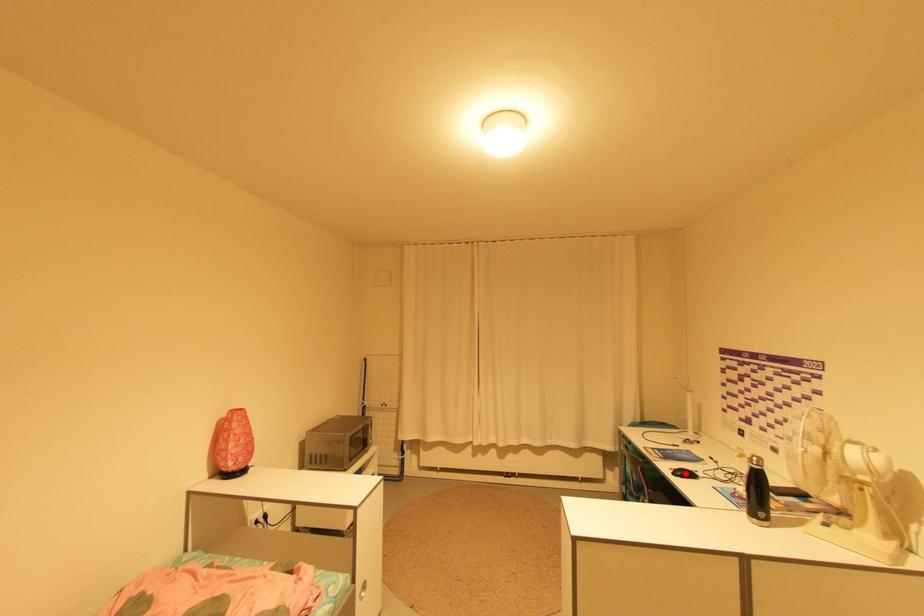
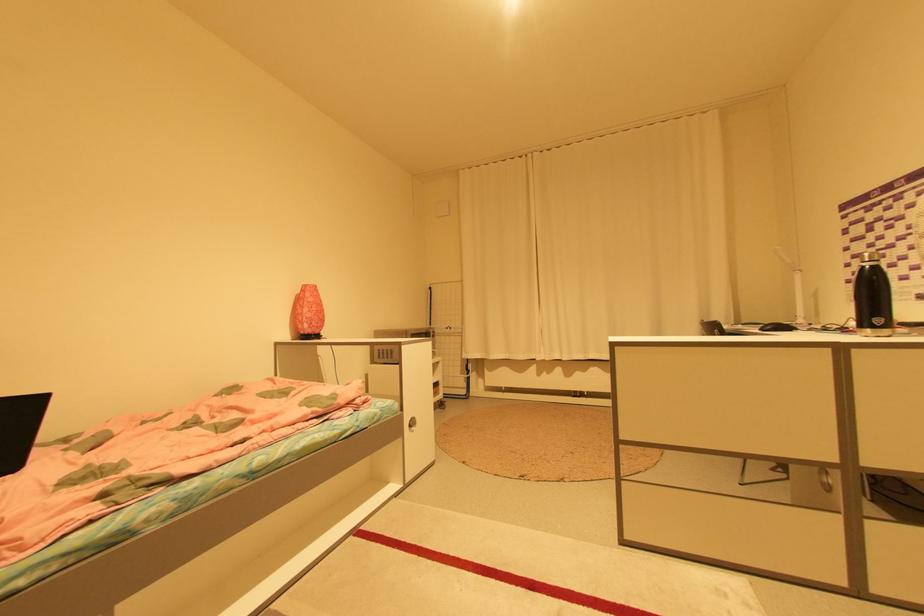
Locate, in the second image, the point that corresponds to the highlighted location in the first image.

(775, 328)